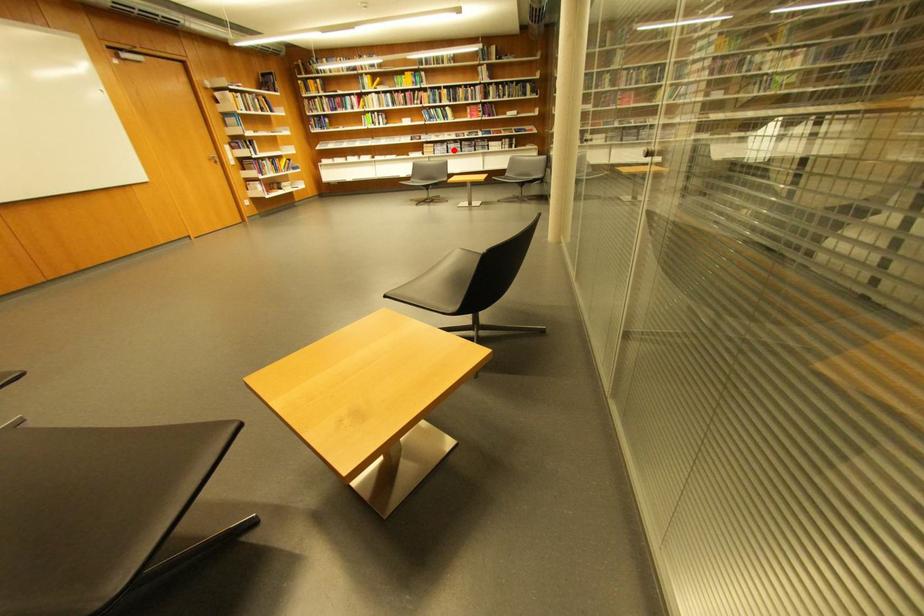
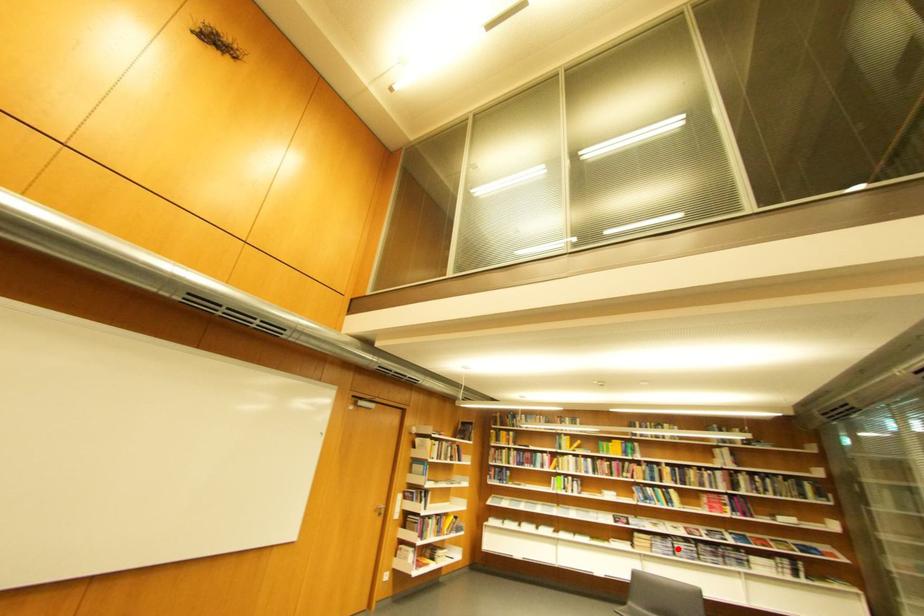
I am providing you with two images of the same scene from different viewpoints. A red point is marked on the first image and another point is marked on the second image. Is the marked point in image1 the same physical position as the marked point in image2?

Yes